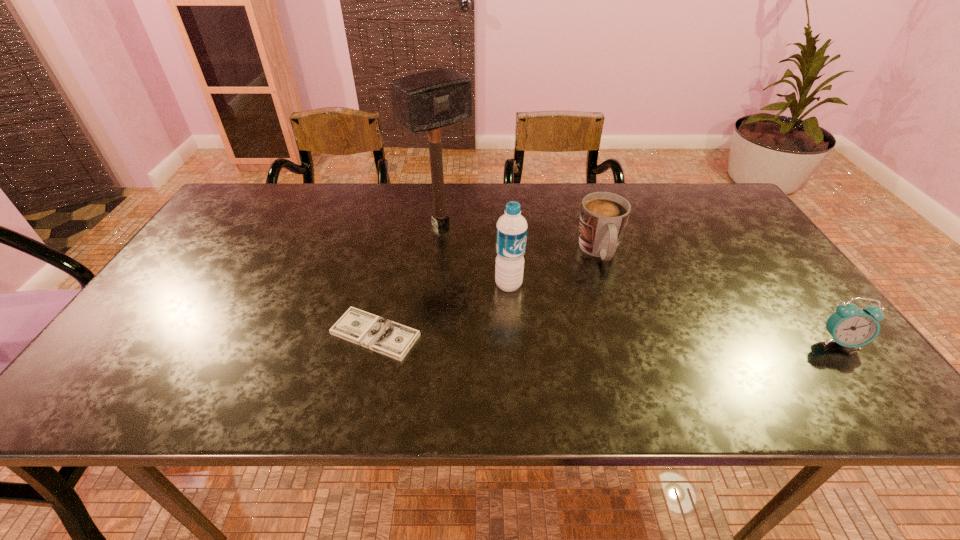
Locate an element on the screen. The height and width of the screenshot is (540, 960). object that is at the near right corner is located at coordinates (850, 326).

I want to click on vacant space at the far edge of the desktop, so (x=379, y=185).

The height and width of the screenshot is (540, 960). Identify the location of free space at the near edge of the desktop. (436, 341).

Locate an element on the screen. blank space at the left edge of the desktop is located at coordinates (218, 277).

This screenshot has width=960, height=540. Identify the location of vacant space at the right edge. (748, 298).

In the image, there is a desktop. Find the location of `vacant region at the far left corner`. vacant region at the far left corner is located at coordinates (274, 210).

Identify the location of vacant area at the near right corner. The width and height of the screenshot is (960, 540). (803, 349).

The height and width of the screenshot is (540, 960). I want to click on free point between the dollar and the water bottle, so click(x=442, y=309).

Locate an element on the screen. vacant area between the shortest object and the rightmost object is located at coordinates (608, 338).

Find the location of `vacant space that's between the mallet and the water bottle`. vacant space that's between the mallet and the water bottle is located at coordinates (474, 254).